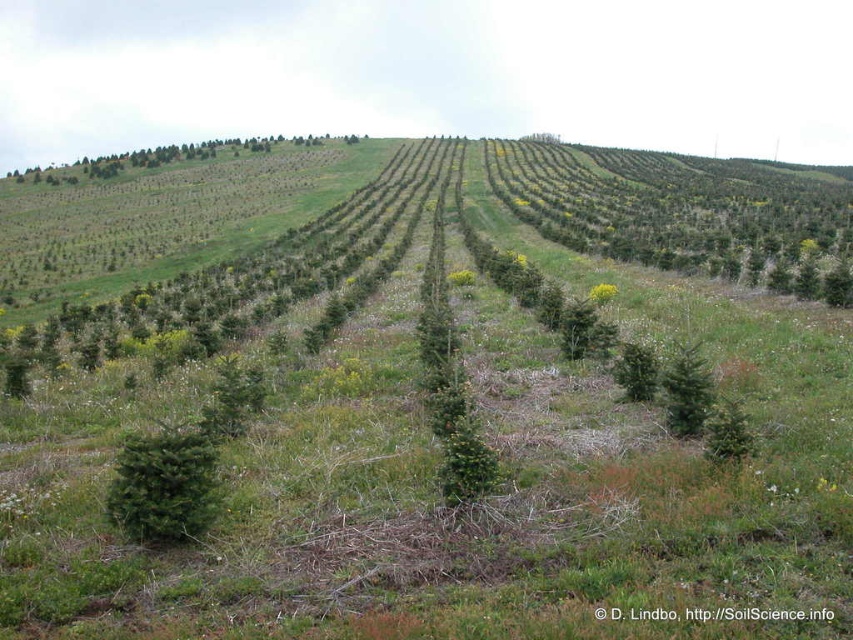
Is green matte tree at lower left to the right of green matte evergreen tree at center from the viewer's perspective?

No, green matte tree at lower left is not to the right of green matte evergreen tree at center.

Between point (193, 442) and point (688, 397), which one is positioned behind?

The point (688, 397) is behind.

Image resolution: width=853 pixels, height=640 pixels. I want to click on green matte tree at lower left, so click(165, 484).

Who is positioned more to the right, green matte tree at lower left or green textured tree at center?

From the viewer's perspective, green textured tree at center appears more on the right side.

Based on the photo, who is shorter, green matte tree at lower left or green textured tree at center?

Standing shorter between the two is green textured tree at center.

Which is in front, point (173, 492) or point (637, 356)?

Positioned in front is point (173, 492).

Find the location of a particular element. This screenshot has width=853, height=640. green matte tree at lower left is located at coordinates (165, 484).

What do you see at coordinates (686, 392) in the screenshot?
I see `green matte evergreen tree at center` at bounding box center [686, 392].

Does green matte evergreen tree at center have a greater width compared to green textured tree at center?

Indeed, green matte evergreen tree at center has a greater width compared to green textured tree at center.

Describe the element at coordinates (686, 392) in the screenshot. I see `green matte evergreen tree at center` at that location.

This screenshot has height=640, width=853. What are the coordinates of `green matte evergreen tree at center` in the screenshot? It's located at coord(686,392).